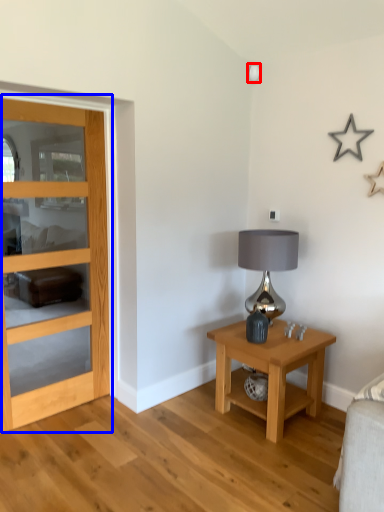
Question: Among these objects, which one is farthest to the camera, lamp (highlighted by a red box) or door (highlighted by a blue box)?

Choices:
 (A) lamp
 (B) door

Answer: (A)